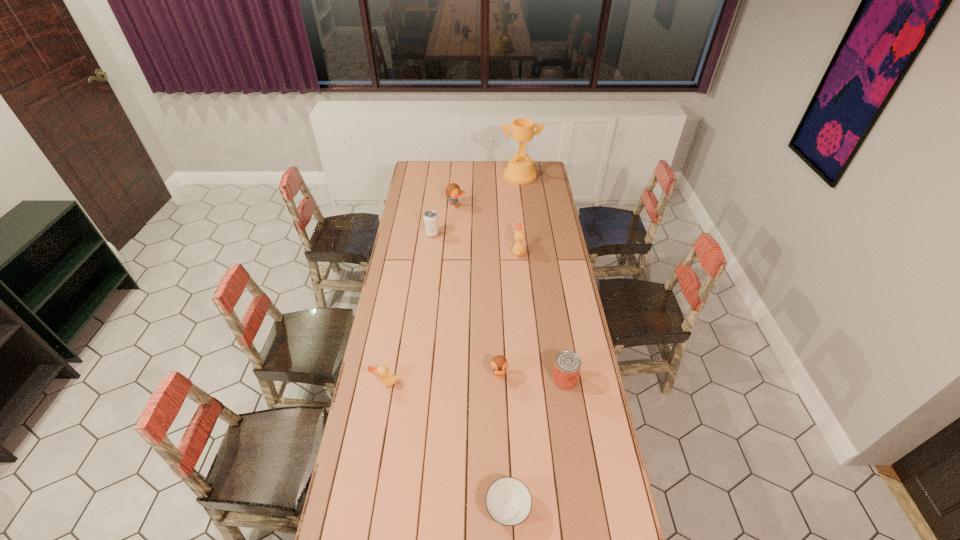
You are a GUI agent. You are given a task and a screenshot of the screen. Output one action in this format:
    pyautogui.click(x=<x>, y=<y>)
    Task: Click on the third duck from left to right
    The width and height of the screenshot is (960, 540).
    Given the screenshot: What is the action you would take?
    pyautogui.click(x=499, y=364)

Locate an element on the screen. the smaller tan duck is located at coordinates (387, 379).

I want to click on the leftmost object, so pos(387,379).

The height and width of the screenshot is (540, 960). Find the location of `soup bowl`. soup bowl is located at coordinates (508, 500).

Where is `the nearest object`? The image size is (960, 540). the nearest object is located at coordinates (508, 500).

This screenshot has height=540, width=960. What are the coordinates of `vacant space located on the left of the tallest object` in the screenshot? It's located at (445, 176).

The width and height of the screenshot is (960, 540). In order to click on free space located on the front-facing side of the bigger blue duck in this screenshot , I will do `click(532, 206)`.

Identify the location of free space located on the beak of the farther tan duck. The image size is (960, 540). (433, 252).

Identify the location of vacant space situated 0.400m on the beak of the farther tan duck. This screenshot has height=540, width=960. (433, 252).

You are a GUI agent. You are given a task and a screenshot of the screen. Output one action in this format:
    pyautogui.click(x=<x>, y=<y>)
    Task: Click on the vacant space located 0.100m on the beak of the farther tan duck
    Image resolution: width=960 pixels, height=540 pixels.
    Given the screenshot: What is the action you would take?
    pyautogui.click(x=492, y=252)